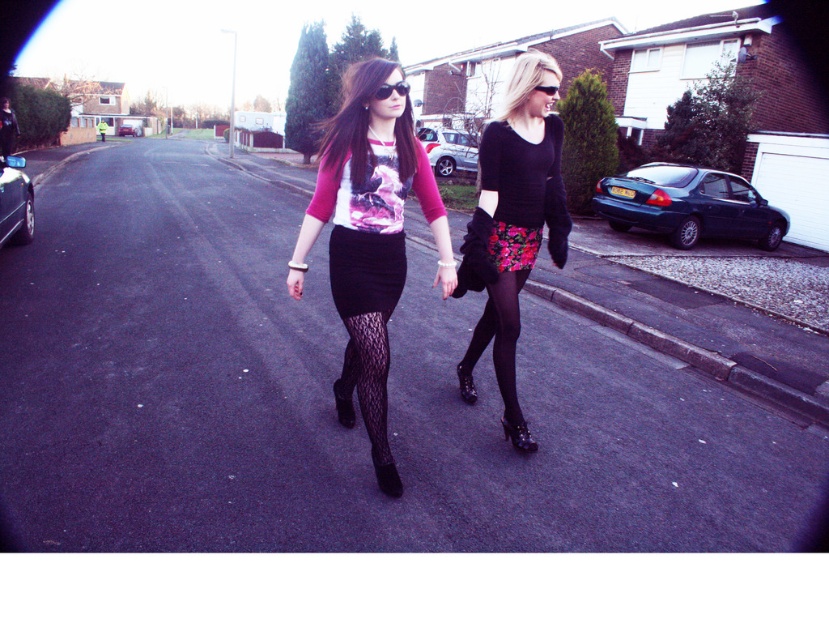
Who is positioned more to the right, shiny black boot at lower center or black plastic sunglasses at center?

shiny black boot at lower center

Does shiny black boot at lower center have a greater height compared to black plastic sunglasses at center?

Indeed, shiny black boot at lower center has a greater height compared to black plastic sunglasses at center.

Is point (526, 440) closer to camera compared to point (381, 99)?

No.

Where is `shiny black boot at lower center`? shiny black boot at lower center is located at coordinates (517, 435).

Between black textured tights at center and black plastic sunglasses at center, which one has less height?

black plastic sunglasses at center is shorter.

Does black textured tights at center have a larger size compared to black plastic sunglasses at center?

Correct, black textured tights at center is larger in size than black plastic sunglasses at center.

Is point (385, 312) farther from viewer compared to point (393, 88)?

Yes.

Find the location of `black textured tights at center`. black textured tights at center is located at coordinates (366, 332).

The width and height of the screenshot is (829, 640). Describe the element at coordinates (369, 228) in the screenshot. I see `matte black skirt at center` at that location.

Does matte black skirt at center come behind black leather boot at center?

No, it is in front of black leather boot at center.

Which is in front, point (395, 120) or point (463, 396)?

Point (395, 120) is more forward.

You are a GUI agent. You are given a task and a screenshot of the screen. Output one action in this format:
    pyautogui.click(x=<x>, y=<y>)
    Task: Click on the matte black skirt at center
    
    Given the screenshot: What is the action you would take?
    pyautogui.click(x=369, y=228)